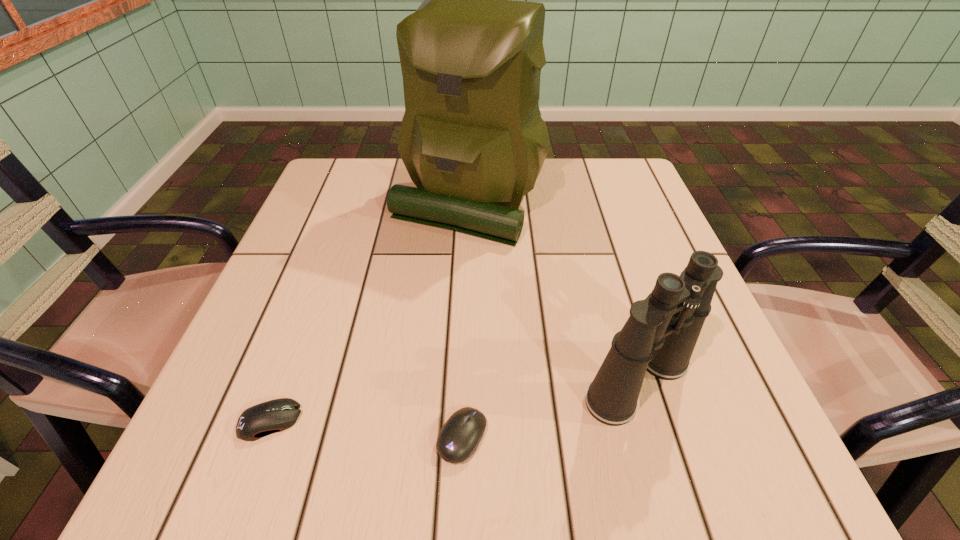
This screenshot has width=960, height=540. Find the location of `empty space between the right computer equipment and the backpack`. empty space between the right computer equipment and the backpack is located at coordinates (465, 319).

Where is `the third closest object to the second tallest object`? the third closest object to the second tallest object is located at coordinates (277, 415).

Identify which object is the third closest to the binoculars. Please provide its 2D coordinates. Your answer should be formatted as a tuple, i.e. [(x, y)], where the tuple contains the x and y coordinates of a point satisfying the conditions above.

[(277, 415)]

Identify the location of vacant space that satisfies the following two spatial constraints: 1. on the back side of the left computer equipment; 2. on the right side of the binoculars. (284, 382).

The image size is (960, 540). What are the coordinates of `free point that satisfies the following two spatial constraints: 1. on the front of the right computer equipment with visible pockets; 2. on the left side of the farthest object` in the screenshot? It's located at (460, 437).

The width and height of the screenshot is (960, 540). Find the location of `vacant space that satisfies the following two spatial constraints: 1. on the back side of the right computer equipment; 2. on the right side of the rightmost object`. vacant space that satisfies the following two spatial constraints: 1. on the back side of the right computer equipment; 2. on the right side of the rightmost object is located at coordinates (464, 382).

Where is `vacant space that satisfies the following two spatial constraints: 1. on the front of the right computer equipment with visible pockets; 2. on the left side of the farthest object`? This screenshot has width=960, height=540. vacant space that satisfies the following two spatial constraints: 1. on the front of the right computer equipment with visible pockets; 2. on the left side of the farthest object is located at coordinates (460, 437).